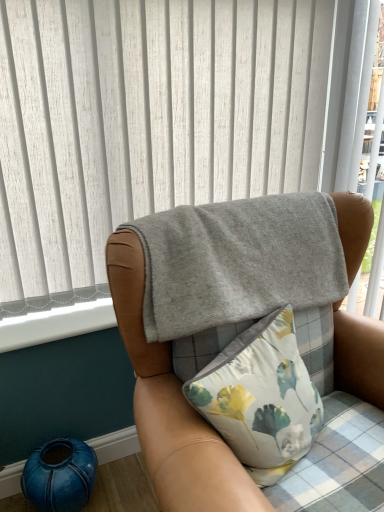
Describe the element at coordinates (56, 324) in the screenshot. The image size is (384, 512). I see `white smooth window sill at lower left` at that location.

Identify the location of teal ceramic vase at lower left. pyautogui.click(x=60, y=476).

Describe the element at coordinates (145, 123) in the screenshot. I see `gray felt blanket at upper center` at that location.

Where is `white smooth window sill at lower left`? white smooth window sill at lower left is located at coordinates (56, 324).

Is white smooth window sill at lower left oriented away from gray fleece blanket at upper center?

No, white smooth window sill at lower left is not facing the opposite direction of gray fleece blanket at upper center.

Is point (109, 313) more distant than point (146, 347)?

Yes, it is behind point (146, 347).

Is the position of white smooth window sill at lower left more distant than that of gray fleece blanket at upper center?

Yes, it is.

Considering the sizes of objects white smooth window sill at lower left and gray fleece blanket at upper center in the image provided, who is taller, white smooth window sill at lower left or gray fleece blanket at upper center?

gray fleece blanket at upper center.

Is white smooth window sill at lower left far away from floral fabric pillow at center?

white smooth window sill at lower left is near floral fabric pillow at center, not far away.

Which is correct: white smooth window sill at lower left is inside floral fabric pillow at center, or outside of it?

white smooth window sill at lower left is not enclosed by floral fabric pillow at center.

Is white smooth window sill at lower left oriented away from floral fabric pillow at center?

No, white smooth window sill at lower left is not facing away from floral fabric pillow at center.

Considering the positions of objects white smooth window sill at lower left and floral fabric pillow at center in the image provided, who is more to the right, white smooth window sill at lower left or floral fabric pillow at center?

floral fabric pillow at center.

Is gray felt blanket at upper center taller than teal ceramic vase at lower left?

Yes.

Is gray felt blanket at upper center beside teal ceramic vase at lower left?

No, gray felt blanket at upper center is not making contact with teal ceramic vase at lower left.

In the scene shown: Does gray felt blanket at upper center lie behind teal ceramic vase at lower left?

No, it is not.

Is gray felt blanket at upper center facing towards teal ceramic vase at lower left?

No, gray felt blanket at upper center is not oriented towards teal ceramic vase at lower left.

Is gray felt blanket at upper center at the back of gray fleece blanket at upper center?

That's right, gray fleece blanket at upper center is facing away from gray felt blanket at upper center.

Between gray fleece blanket at upper center and gray felt blanket at upper center, which one has larger size?

Bigger between the two is gray fleece blanket at upper center.

How different are the orientations of gray fleece blanket at upper center and gray felt blanket at upper center in degrees?

0.302 degrees separate the facing orientations of gray fleece blanket at upper center and gray felt blanket at upper center.

In the scene shown: Based on their positions, is gray fleece blanket at upper center located to the left or right of gray felt blanket at upper center?

In the image, gray fleece blanket at upper center appears on the right side of gray felt blanket at upper center.

Is gray fleece blanket at upper center situated inside teal ceramic vase at lower left or outside?

gray fleece blanket at upper center is outside teal ceramic vase at lower left.

Measure the distance from gray fleece blanket at upper center to teal ceramic vase at lower left.

They are 22.73 inches apart.

From the image's perspective, is gray fleece blanket at upper center located above or below teal ceramic vase at lower left?

gray fleece blanket at upper center is situated higher than teal ceramic vase at lower left in the image.

Considering the relative sizes of gray fleece blanket at upper center and teal ceramic vase at lower left in the image provided, is gray fleece blanket at upper center taller than teal ceramic vase at lower left?

Indeed, gray fleece blanket at upper center has a greater height compared to teal ceramic vase at lower left.

Does teal ceramic vase at lower left have a larger size compared to white smooth window sill at lower left?

Yes.

Based on the photo, which is closer, (36, 477) or (41, 322)?

The point (36, 477) is closer.

Considering the sizes of objects teal ceramic vase at lower left and white smooth window sill at lower left in the image provided, who is shorter, teal ceramic vase at lower left or white smooth window sill at lower left?

white smooth window sill at lower left is shorter.

Which object is more forward, gray fleece blanket at upper center or white smooth window sill at lower left?

gray fleece blanket at upper center.

In terms of size, does gray fleece blanket at upper center appear bigger or smaller than white smooth window sill at lower left?

Considering their sizes, gray fleece blanket at upper center takes up more space than white smooth window sill at lower left.

Which is correct: gray fleece blanket at upper center is inside white smooth window sill at lower left, or outside of it?

gray fleece blanket at upper center is spatially situated outside white smooth window sill at lower left.

At what (x,y) coordinates should I click in order to perform the action: click on chair in front of the white smooth window sill at lower left. Please return your answer as a coordinate pair (x, y). Looking at the image, I should click on (171, 407).

Locate an element on the screen. pillow below the white smooth window sill at lower left (from a real-world perspective) is located at coordinates (261, 397).

From the image, which object appears to be nearer to gray felt blanket at upper center, floral fabric pillow at center or gray fleece blanket at upper center?

The object closer to gray felt blanket at upper center is gray fleece blanket at upper center.

Considering their positions, is white smooth window sill at lower left positioned closer to gray felt blanket at upper center than teal ceramic vase at lower left?

white smooth window sill at lower left is closer to gray felt blanket at upper center.

When comparing their distances from teal ceramic vase at lower left, does white smooth window sill at lower left or gray fleece blanket at upper center seem further?

Among the two, gray fleece blanket at upper center is located further to teal ceramic vase at lower left.

Looking at the image, which one is located closer to gray fleece blanket at upper center, teal ceramic vase at lower left or white smooth window sill at lower left?

white smooth window sill at lower left is positioned closer to the anchor gray fleece blanket at upper center.

When comparing their distances from gray felt blanket at upper center, does teal ceramic vase at lower left or gray fleece blanket at upper center seem closer?

gray fleece blanket at upper center.

Considering their positions, is gray fleece blanket at upper center positioned closer to white smooth window sill at lower left than gray felt blanket at upper center?

The object closer to white smooth window sill at lower left is gray fleece blanket at upper center.

Based on their spatial positions, is white smooth window sill at lower left or floral fabric pillow at center further from gray felt blanket at upper center?

floral fabric pillow at center.

Looking at the image, which one is located further to white smooth window sill at lower left, gray fleece blanket at upper center or teal ceramic vase at lower left?

gray fleece blanket at upper center is positioned further to the anchor white smooth window sill at lower left.

Identify the location of chair that lies between gray felt blanket at upper center and teal ceramic vase at lower left from top to bottom. This screenshot has width=384, height=512. (171, 407).

At what (x,y) coordinates should I click in order to perform the action: click on curtain positioned between gray fleece blanket at upper center and white smooth window sill at lower left from near to far. Please return your answer as a coordinate pair (x, y). The height and width of the screenshot is (512, 384). Looking at the image, I should click on point(145,123).

Find the location of a particular element. window sill between gray felt blanket at upper center and floral fabric pillow at center in the vertical direction is located at coordinates (56, 324).

Find the location of a particular element. pillow that lies between gray felt blanket at upper center and teal ceramic vase at lower left from top to bottom is located at coordinates (261, 397).